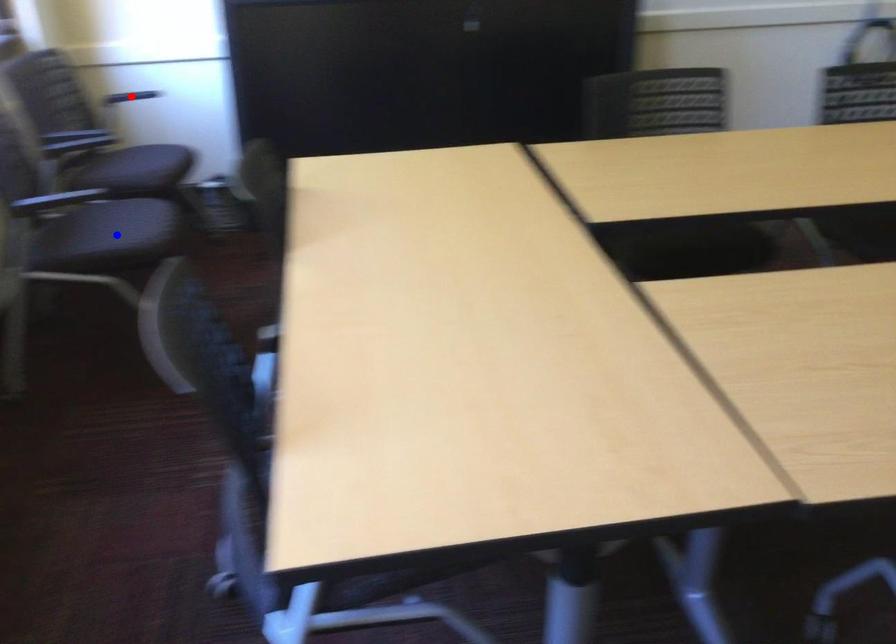
Question: In the image, two points are highlighted. Which point is nearer to the camera? Reply with the corresponding letter.

Choices:
 (A) blue point
 (B) red point

Answer: (A)